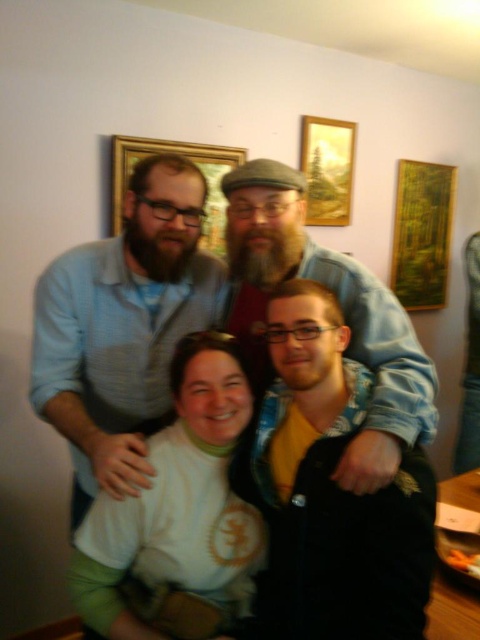
Can you confirm if wooden frame at upper center is shorter than gold textured painting at upper center?

Indeed, wooden frame at upper center has a lesser height compared to gold textured painting at upper center.

Does wooden frame at upper center appear over gold textured painting at upper center?

Actually, wooden frame at upper center is below gold textured painting at upper center.

Between point (219, 180) and point (314, 163), which one is positioned behind?

Point (314, 163)

Where is `wooden frame at upper center`? The width and height of the screenshot is (480, 640). wooden frame at upper center is located at coordinates (195, 168).

Between white matte shirt at center and gold textured painting at upper center, which one is positioned higher?

gold textured painting at upper center

Who is positioned more to the left, white matte shirt at center or gold textured painting at upper center?

white matte shirt at center is more to the left.

Identify the location of white matte shirt at center. (178, 515).

Does black matte jacket at center have a lesser width compared to gold textured painting at upper center?

No, black matte jacket at center is not thinner than gold textured painting at upper center.

Between black matte jacket at center and gold textured painting at upper center, which one has more height?

Standing taller between the two is black matte jacket at center.

Between point (312, 536) and point (344, 216), which one is positioned behind?

Positioned behind is point (344, 216).

Find the location of a particular element. black matte jacket at center is located at coordinates (330, 490).